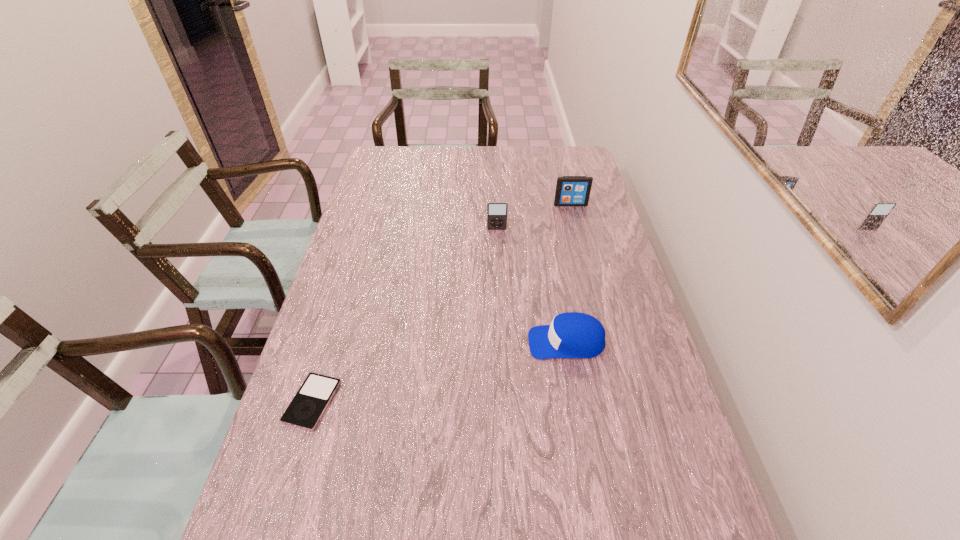
At what (x,y) coordinates should I click in order to perform the action: click on the farthest iPod. Please return your answer as a coordinate pair (x, y). Looking at the image, I should click on (570, 190).

Where is `the rightmost iPod`? The height and width of the screenshot is (540, 960). the rightmost iPod is located at coordinates (570, 190).

This screenshot has height=540, width=960. I want to click on the second iPod from left to right, so click(496, 211).

I want to click on the second nearest iPod, so click(496, 211).

Identify the location of baseball cap. The width and height of the screenshot is (960, 540). (577, 335).

Locate an element on the screen. The image size is (960, 540). the third tallest object is located at coordinates (577, 335).

Find the location of `the shortest object`. the shortest object is located at coordinates (310, 402).

What are the coordinates of `the leftmost object` in the screenshot? It's located at (310, 402).

Locate an element on the screen. This screenshot has width=960, height=540. blank space located 0.330m on the front screen of the rightmost iPod is located at coordinates (587, 268).

Image resolution: width=960 pixels, height=540 pixels. Find the location of `free space located 0.340m on the front-facing side of the second farthest iPod`. free space located 0.340m on the front-facing side of the second farthest iPod is located at coordinates (500, 303).